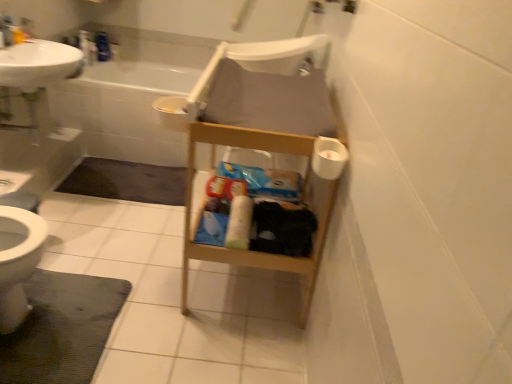
Identify the location of vacant space situated above dark gray carpet at lower left, placed as the 2th bath mat when sorted from front to back (from a real-world perspective). (141, 172).